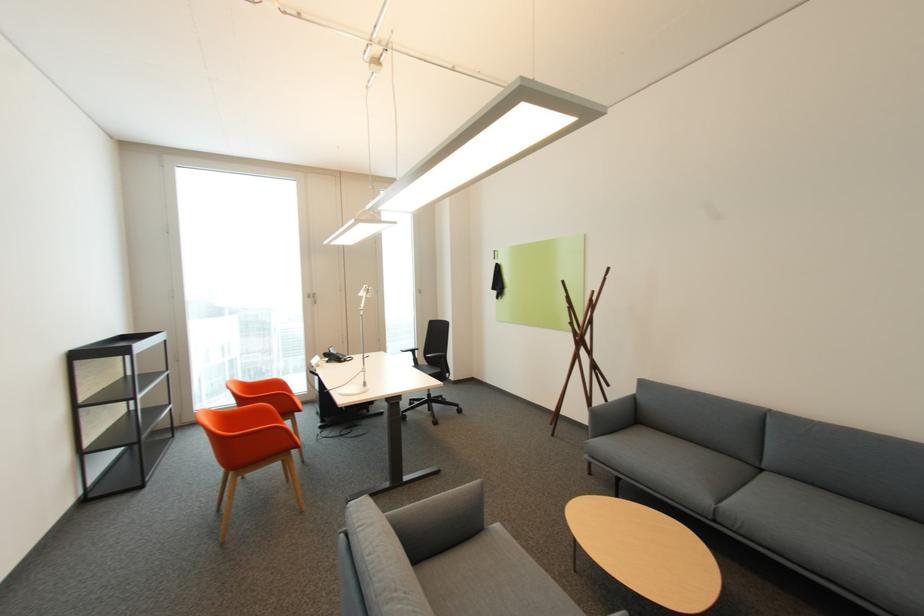
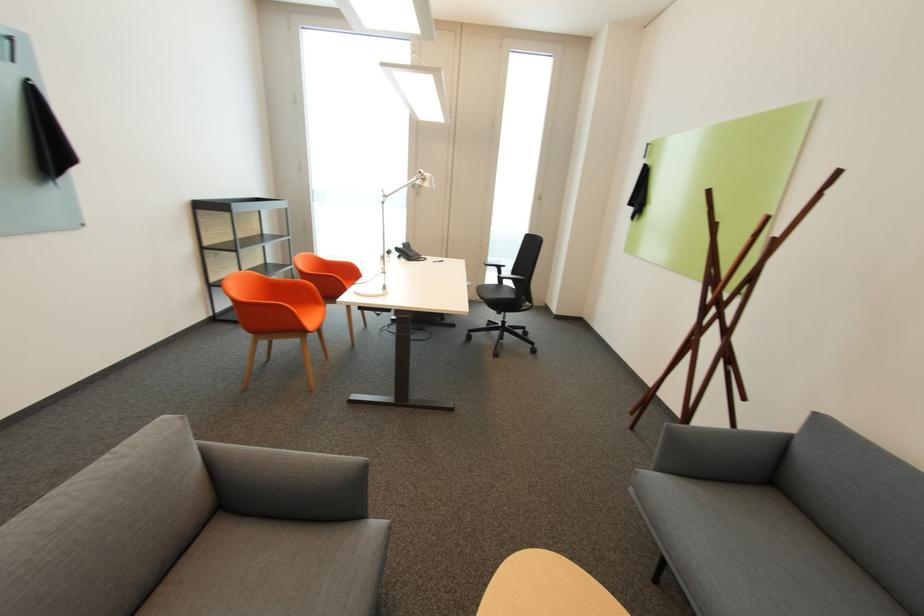
Find the pixel in the second image that matches pixel 557 424 in the first image.

(638, 414)